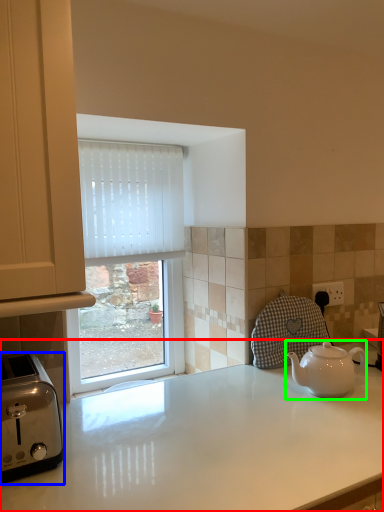
Question: Which is farther away from countertop (highlighted by a red box)? toaster (highlighted by a blue box) or kettle (highlighted by a green box)?

Choices:
 (A) toaster
 (B) kettle

Answer: (A)